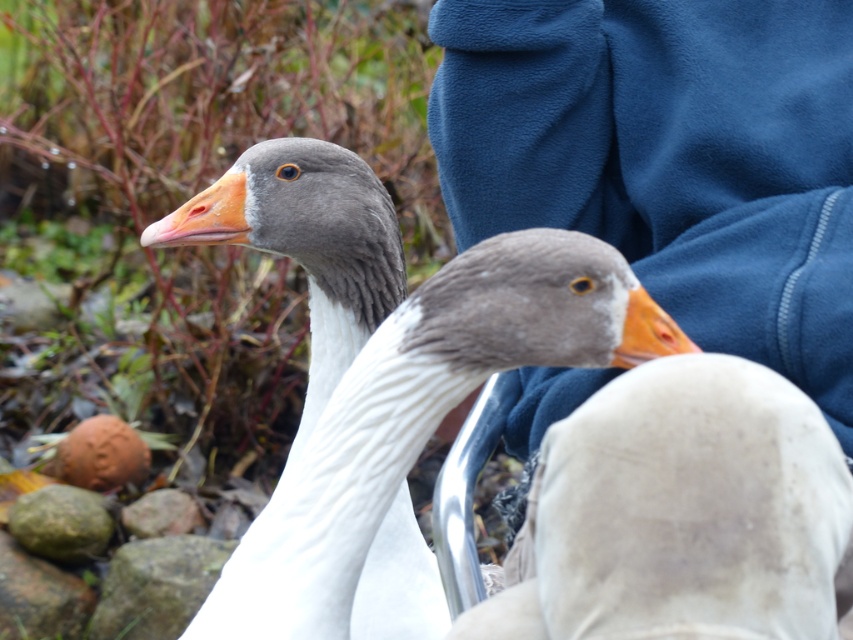
You are a photographer trying to capture a clear shot of the white matte goose at center and the gray rough rock at lower left. Since you want both subjects in focus, which one should you focus on first to ensure the other is also in focus?

The white matte goose at center is located above the gray rough rock at lower left, so you should focus on the white matte goose at center first since it is farther away from the camera, ensuring the gray rough rock at lower left will also be in focus.

You are a photographer trying to capture both the white matte duck at center and the brown clay stone at lower left in a single shot. Given their sizes, which object will appear bigger in the photo?

The white matte duck at center will appear bigger in the photo because it is larger in size than the brown clay stone at lower left.

You are a photographer trying to capture a photo of the white matte duck at center and the brown clay stone at lower left. Based on their positions, which object should you focus on first to ensure both are in the frame?

The white matte duck at center is located above the brown clay stone at lower left, so you should focus on the brown clay stone at lower left first to ensure both are in the frame.